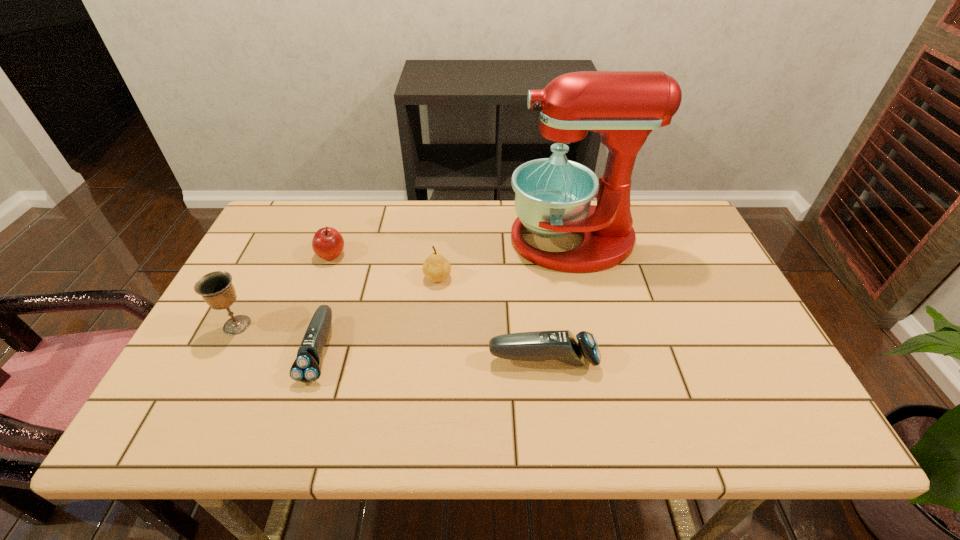
This screenshot has width=960, height=540. I want to click on vacant place for an extra electric shaver on the right, so click(775, 369).